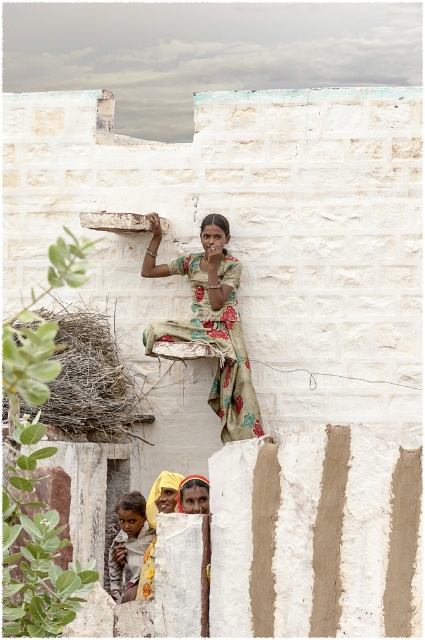
Is floral cotton dress at center positioned at the back of brown textured cloth at lower left?

Yes, floral cotton dress at center is behind brown textured cloth at lower left.

Locate an element on the screen. This screenshot has width=425, height=640. floral cotton dress at center is located at coordinates (215, 344).